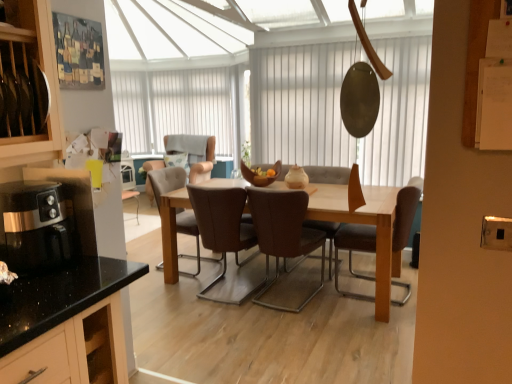
At what (x,y) coordinates should I click in order to perform the action: click on free space in front of brown leather chair at center, marked as the 3th chair in a front-to-back arrangement. Please return your answer as a coordinate pair (x, y). Looking at the image, I should click on (227, 317).